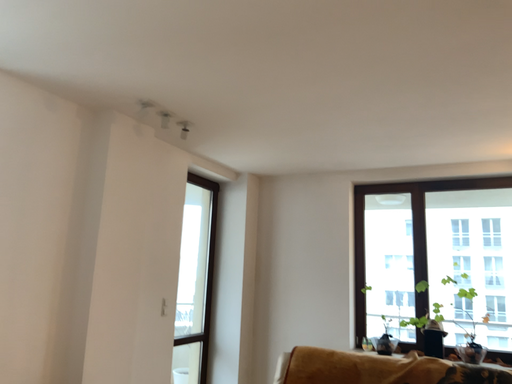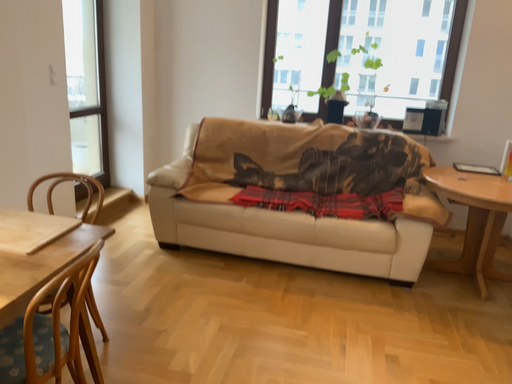
Question: How did the camera likely rotate when shooting the video?

Choices:
 (A) rotated right
 (B) rotated left

Answer: (A)